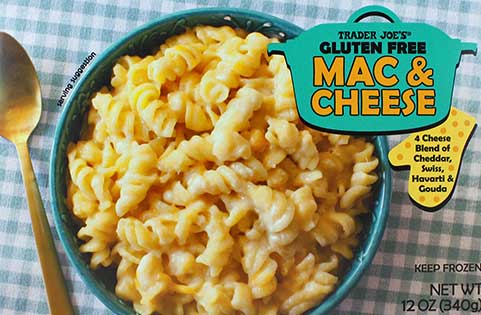
Locate an element on the screen. The width and height of the screenshot is (481, 315). orange dot on oven mit is located at coordinates (423, 200).